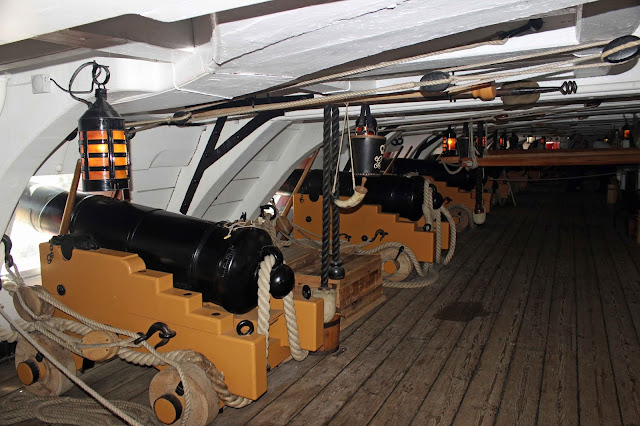
Locate an element on the screen. The height and width of the screenshot is (426, 640). lantern is located at coordinates (91, 150), (371, 124), (445, 137), (482, 138), (500, 136), (530, 139), (625, 136).